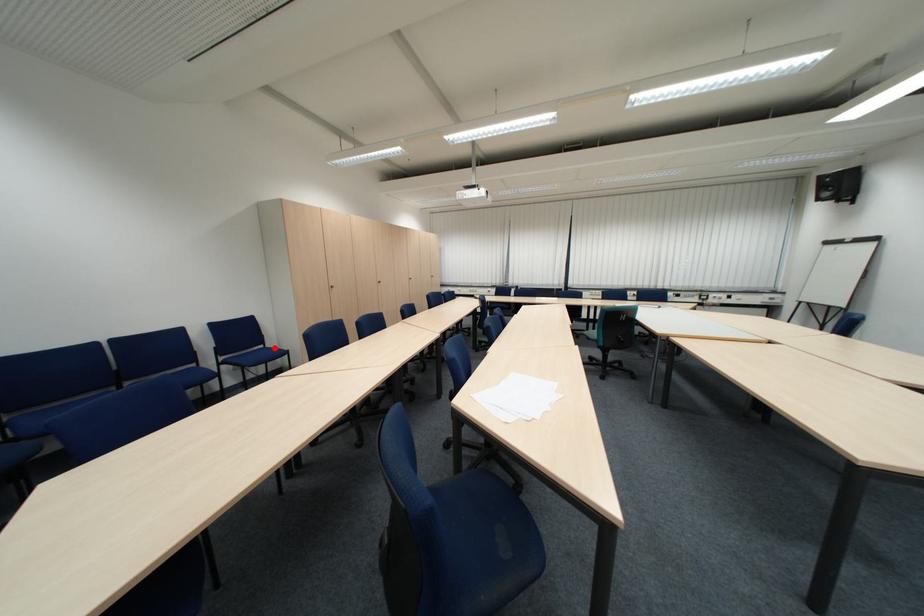
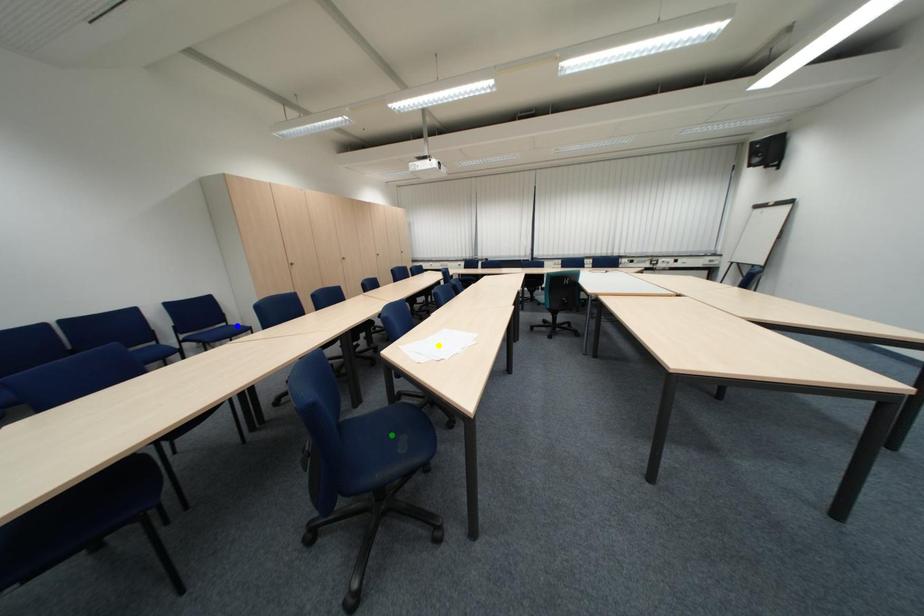
Question: I am providing you with two images of the same scene from different viewpoints. A red point is marked on the first image. You are given multiple points on the second image. Which point in image 2 is actually the same real-world point as the red point in image 1?

Choices:
 (A) yellow point
 (B) green point
 (C) blue point

Answer: (C)